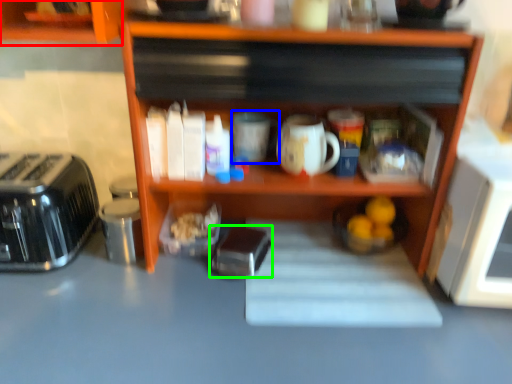
Question: Which object is the farthest from cabinetry (highlighted by a red box)? Choose among these: mug (highlighted by a blue box) or appliance (highlighted by a green box).

Choices:
 (A) mug
 (B) appliance

Answer: (B)